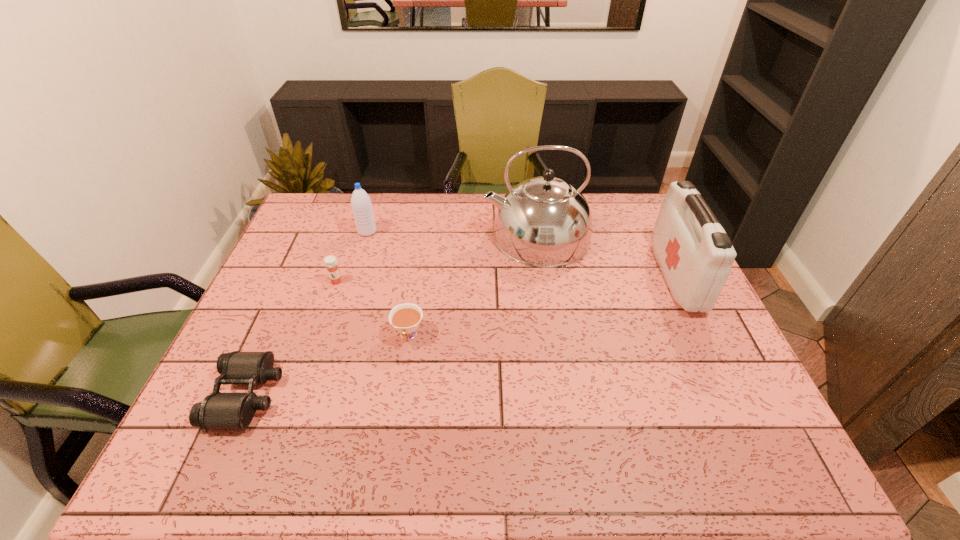
You are a GUI agent. You are given a task and a screenshot of the screen. Output one action in this format:
    pyautogui.click(x=<x>, y=<y>)
    Task: Click on the free space that satisfies the following two spatial constraints: 1. on the label side of the medicine; 2. through the eyepieces of the nearest object
    The width and height of the screenshot is (960, 540).
    Given the screenshot: What is the action you would take?
    pyautogui.click(x=298, y=395)